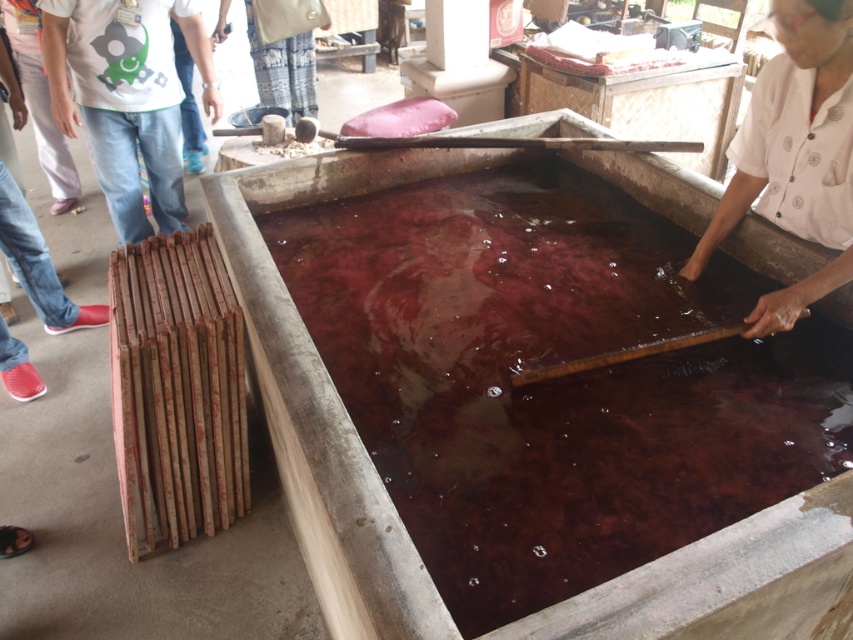
Question: Does white dotted shirt at upper right have a larger size compared to white cotton shirt at upper left?

Choices:
 (A) yes
 (B) no

Answer: (B)

Question: Is brown translucent water at center thinner than white dotted shirt at upper right?

Choices:
 (A) yes
 (B) no

Answer: (B)

Question: Is brown translucent water at center to the right of white cotton shirt at upper left from the viewer's perspective?

Choices:
 (A) yes
 (B) no

Answer: (A)

Question: Which of the following is the closest to the observer?

Choices:
 (A) white dotted shirt at upper right
 (B) white cotton shirt at upper left
 (C) brown translucent water at center

Answer: (C)

Question: Which point is farther to the camera?

Choices:
 (A) (120, 196)
 (B) (358, 346)

Answer: (A)

Question: Which object appears farthest from the camera in this image?

Choices:
 (A) brown translucent water at center
 (B) white cotton shirt at upper left

Answer: (B)